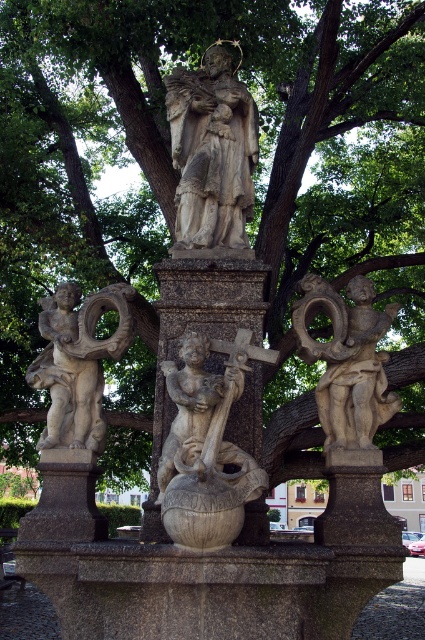
Can you confirm if carved stone cherub at center is positioned to the right of stone statue at center?

Indeed, carved stone cherub at center is positioned on the right side of stone statue at center.

Is carved stone cherub at center thinner than stone statue at center?

Yes, carved stone cherub at center is thinner than stone statue at center.

Which is in front, point (204, 492) or point (207, 131)?

Positioned in front is point (204, 492).

Where is `carved stone cherub at center`? The height and width of the screenshot is (640, 425). carved stone cherub at center is located at coordinates (206, 445).

Is carved stone cherub at center wider than stone angel at left?

No, carved stone cherub at center is not wider than stone angel at left.

Is carved stone cherub at center smaller than stone angel at left?

Yes, carved stone cherub at center is smaller than stone angel at left.

What are the coordinates of `carved stone cherub at center` in the screenshot? It's located at (206, 445).

Locate an element on the screen. carved stone cherub at center is located at coordinates (206, 445).

Between matte stone cherub at right and stone angel at left, which one appears on the right side from the viewer's perspective?

Positioned to the right is matte stone cherub at right.

Is point (365, 365) less distant than point (96, 355)?

Yes, point (365, 365) is closer to viewer.

Describe the element at coordinates (346, 360) in the screenshot. This screenshot has width=425, height=640. I see `matte stone cherub at right` at that location.

The width and height of the screenshot is (425, 640). Find the location of `matte stone cherub at right`. matte stone cherub at right is located at coordinates (346, 360).